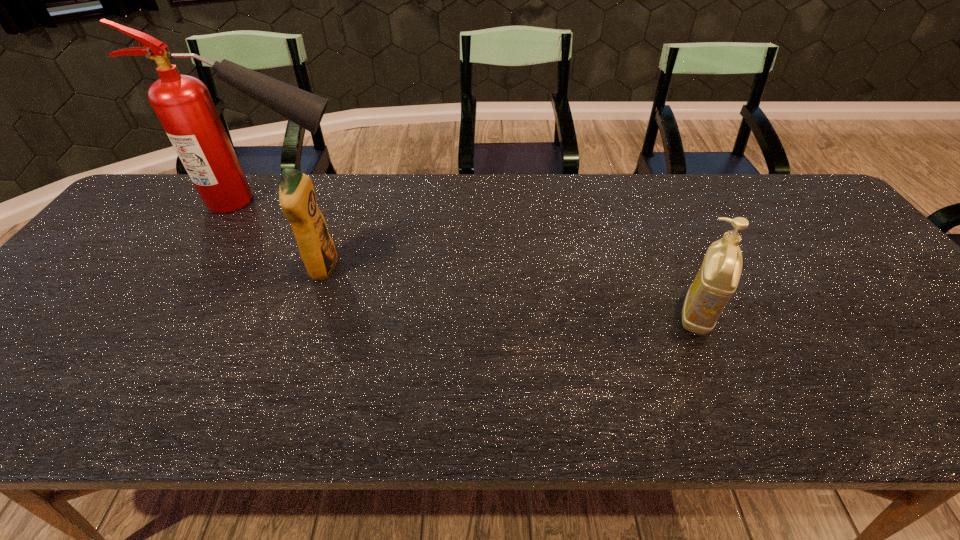
You are a GUI agent. You are given a task and a screenshot of the screen. Output one action in this format:
    pyautogui.click(x=<x>, y=<y>)
    Task: Click on the free space that satisfies the following two spatial constraints: 1. on the label of the farther detergent; 2. on the right side of the shorter detergent
    The height and width of the screenshot is (540, 960).
    Given the screenshot: What is the action you would take?
    307,315